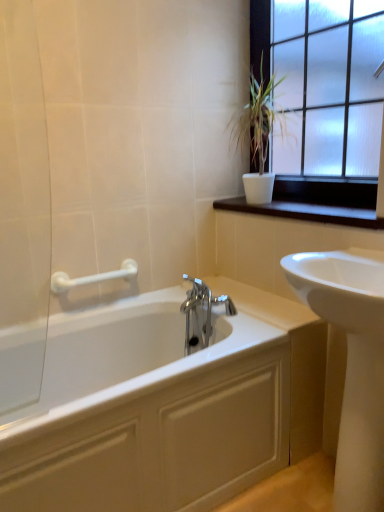
The width and height of the screenshot is (384, 512). Find the location of `vacant area that lies between frosted glass window at upper right and white ceramic plant at upper right`. vacant area that lies between frosted glass window at upper right and white ceramic plant at upper right is located at coordinates point(311,208).